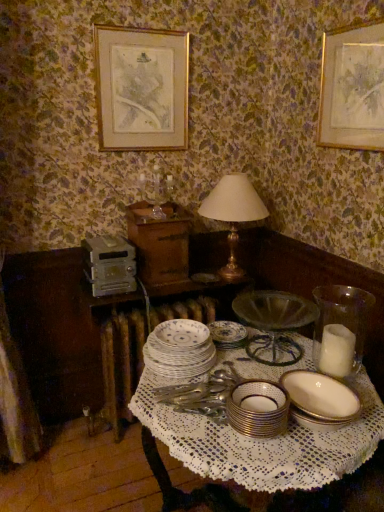
Where is `free space above white porcelain table at center (from a real-world perspective)`? Image resolution: width=384 pixels, height=512 pixels. free space above white porcelain table at center (from a real-world perspective) is located at coordinates (254, 373).